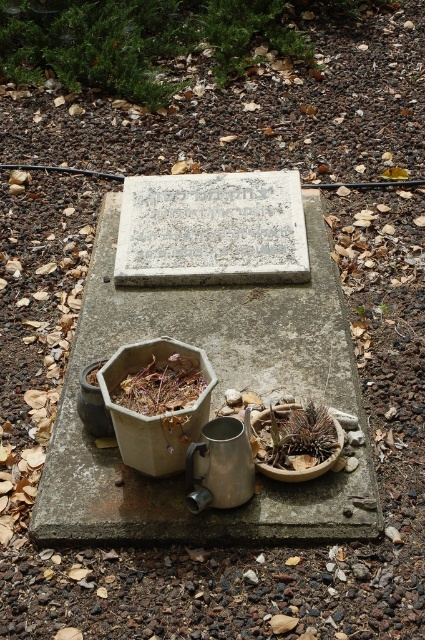
You are standing in front of the grave marker and want to place a flower on the green succulent at center. Can you reach it without moving the gray concrete at center?

The gray concrete at center is closer to the viewer than the green succulent at center, so you would need to move the gray concrete at center to reach the green succulent at center.

You are standing at the origin point of the coordinate system. You want to place a new memorial item at the exact center of the gray concrete at center. What are the coordinates where you should place it?

The coordinates for the exact center of the gray concrete at center are point (212, 403).